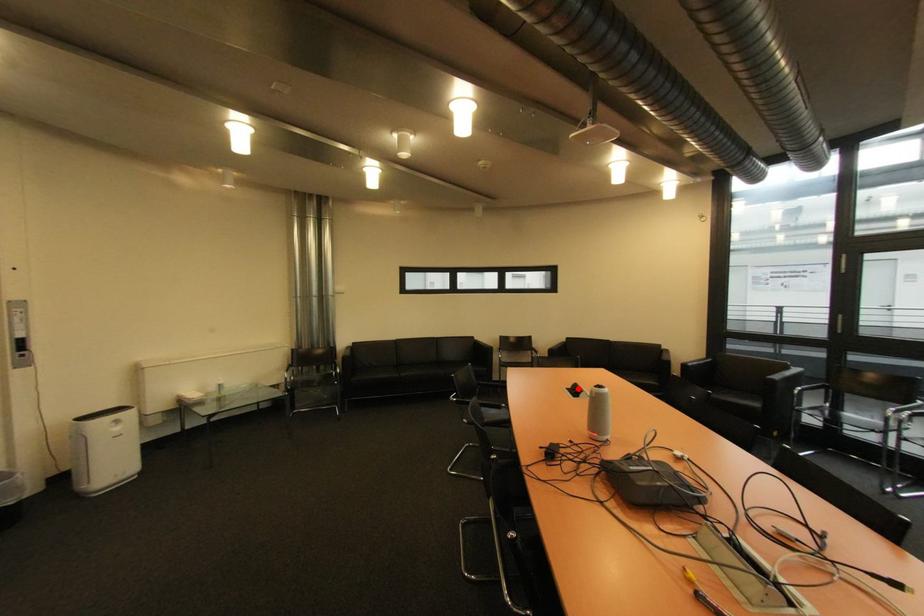
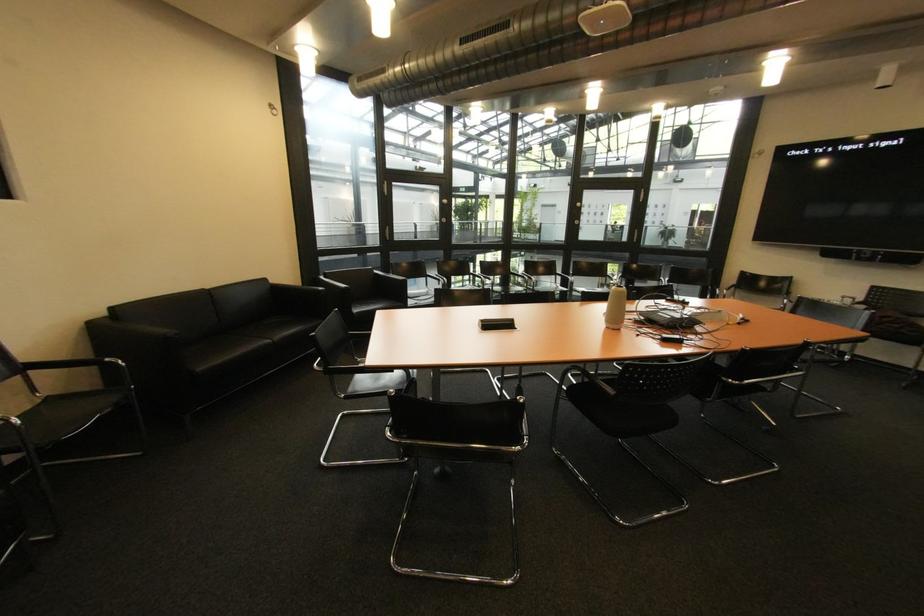
Question: I am providing you with two images of the same scene from different viewpoints. A red point is marked on the first image. Can you still see the location of the red point in image 2?

Choices:
 (A) Yes
 (B) No

Answer: (B)